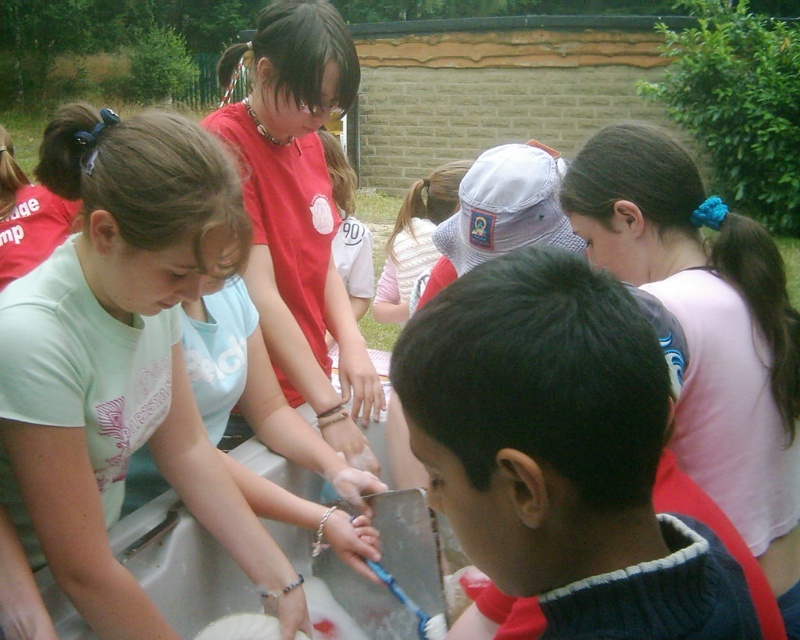
Can you confirm if dark blue sweater at center is positioned above smooth skin hand at center?

Yes, dark blue sweater at center is above smooth skin hand at center.

Is point (510, 365) positioned behind point (362, 477)?

That is False.

Locate an element on the screen. The image size is (800, 640). dark blue sweater at center is located at coordinates (541, 413).

Is light green t-shirt at center further to the viewer compared to smooth skin hand at center?

No, light green t-shirt at center is closer to the viewer.

Is light green t-shirt at center positioned before smooth skin hand at center?

Yes.

Find the location of a particular element. The image size is (800, 640). light green t-shirt at center is located at coordinates (124, 362).

From the picture: Can you confirm if light green t-shirt at center is shorter than pink fabric ponytail at upper right?

No, light green t-shirt at center is not shorter than pink fabric ponytail at upper right.

Consider the image. Which is above, light green t-shirt at center or pink fabric ponytail at upper right?

pink fabric ponytail at upper right

Does point (60, 362) lie in front of point (758, 451)?

Yes, point (60, 362) is closer to viewer.

Where is `light green t-shirt at center`? light green t-shirt at center is located at coordinates (124, 362).